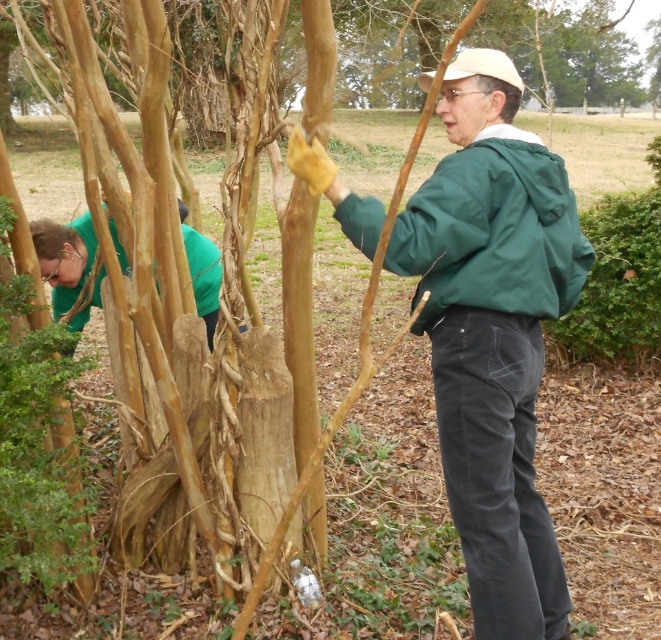
Question: In this image, where is green matte jacket at center located relative to green matte shirt at left?

Choices:
 (A) right
 (B) left

Answer: (A)

Question: Which is nearer to the green matte jacket at center?

Choices:
 (A) green matte jacket at right
 (B) green matte shirt at left

Answer: (A)

Question: Among these objects, which one is nearest to the camera?

Choices:
 (A) green matte jacket at center
 (B) green matte shirt at left
 (C) green matte jacket at right

Answer: (C)

Question: Does green matte jacket at right appear on the right side of green matte shirt at left?

Choices:
 (A) no
 (B) yes

Answer: (B)

Question: Which of these objects is positioned closest to the green matte jacket at right?

Choices:
 (A) green matte jacket at center
 (B) green matte shirt at left

Answer: (A)

Question: Can you confirm if green matte jacket at right is positioned below green matte shirt at left?

Choices:
 (A) yes
 (B) no

Answer: (A)